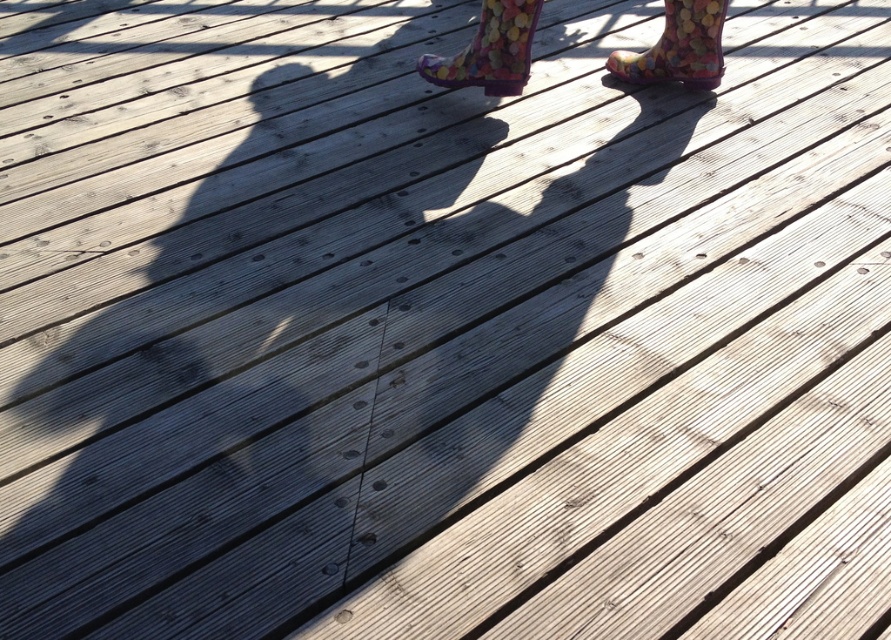
Who is more distant from viewer, (524, 65) or (697, 83)?

The point (697, 83) is behind.

At what (x,y) coordinates should I click in order to perform the action: click on multicolored rubber boots at center. Please return your answer as a coordinate pair (x, y). Looking at the image, I should click on (489, 51).

Which is below, floral rubber boot at upper center or multicolored rubber boot at upper right?

Positioned lower is floral rubber boot at upper center.

In the scene shown: How much distance is there between floral rubber boot at upper center and multicolored rubber boot at upper right?

The distance of floral rubber boot at upper center from multicolored rubber boot at upper right is 15.65 inches.

Does point (503, 86) come in front of point (713, 45)?

No, (503, 86) is behind (713, 45).

Identify the location of floral rubber boot at upper center. This screenshot has height=640, width=891. (489, 51).

Is multicolored rubber boots at center to the right of floral rubber boot at upper center from the viewer's perspective?

Incorrect, multicolored rubber boots at center is not on the right side of floral rubber boot at upper center.

The height and width of the screenshot is (640, 891). Describe the element at coordinates (489, 51) in the screenshot. I see `multicolored rubber boots at center` at that location.

Locate an element on the screen. The width and height of the screenshot is (891, 640). multicolored rubber boots at center is located at coordinates (489, 51).